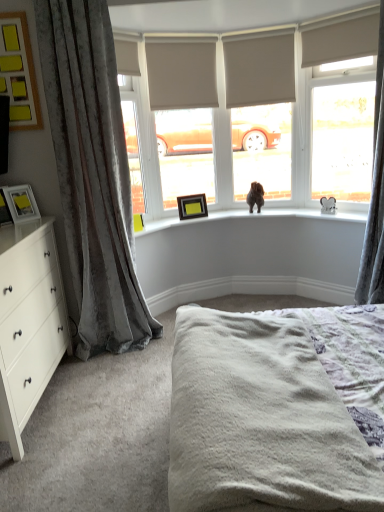
Locate an element on the screen. vacant area situated below beige fabric blind at upper center, placed as the third blind when sorted from right to left (from a real-world perspective) is located at coordinates (206, 211).